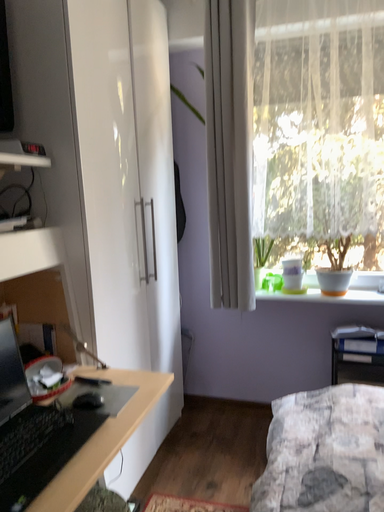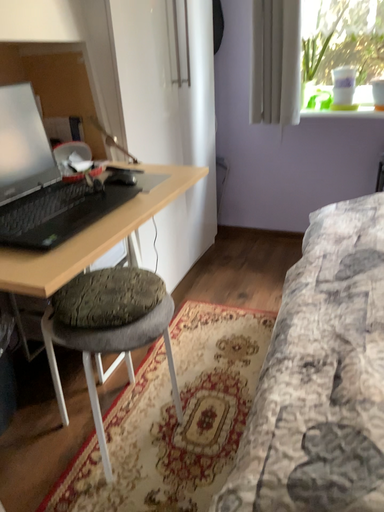
Question: How did the camera likely rotate when shooting the video?

Choices:
 (A) rotated downward
 (B) rotated upward

Answer: (A)